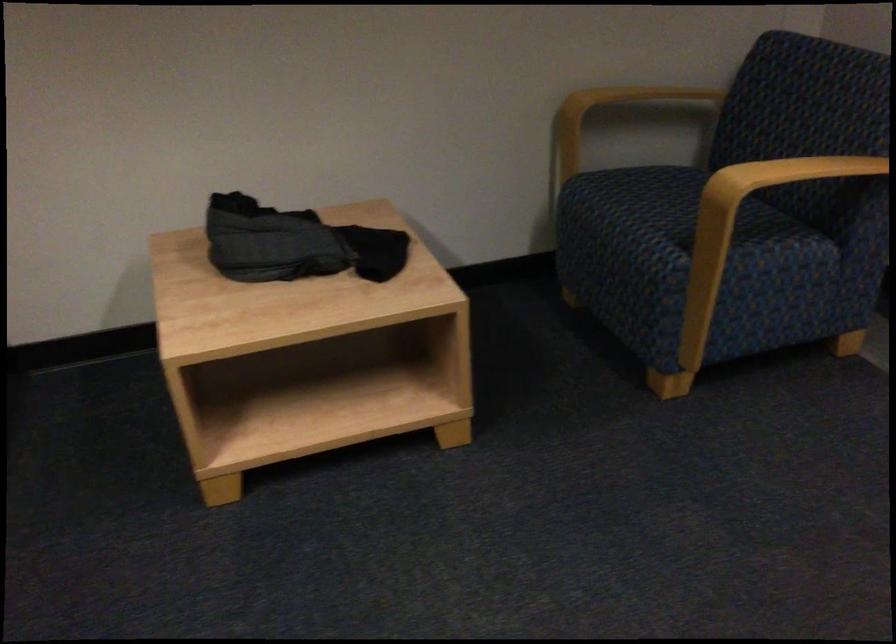
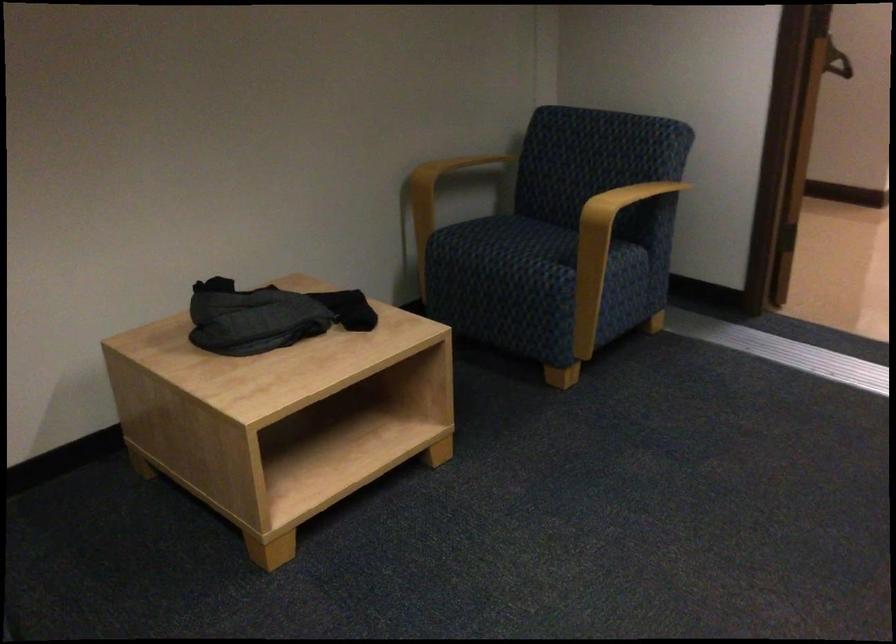
Question: The camera is either moving clockwise (left) or counter-clockwise (right) around the object. The first image is from the beginning of the video and the second image is from the end. Is the camera moving left or right when shooting the video?

Choices:
 (A) Left
 (B) Right

Answer: (A)